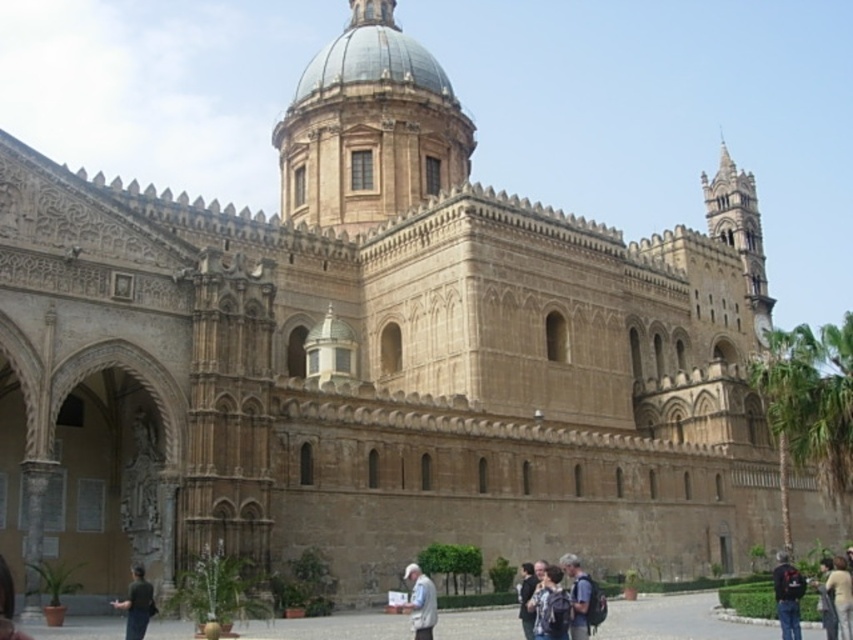
Which is more to the right, black fabric backpack at lower right or white fabric shirt at center?

From the viewer's perspective, black fabric backpack at lower right appears more on the right side.

Does black fabric backpack at lower right appear on the left side of white fabric shirt at center?

Incorrect, black fabric backpack at lower right is not on the left side of white fabric shirt at center.

Does point (782, 637) come farther from viewer compared to point (413, 589)?

No, (782, 637) is closer to viewer.

Locate an element on the screen. black fabric backpack at lower right is located at coordinates (787, 595).

Between light brown leather jacket at center and light brown leather jacket at lower right, which one appears on the left side from the viewer's perspective?

From the viewer's perspective, light brown leather jacket at lower right appears more on the left side.

Is light brown leather jacket at center smaller than light brown leather jacket at lower right?

No, light brown leather jacket at center is not smaller than light brown leather jacket at lower right.

Between point (838, 564) and point (828, 595), which one is positioned behind?

The point (838, 564) is more distant.

This screenshot has height=640, width=853. I want to click on light brown leather jacket at center, so click(840, 595).

Between dark gray backpack at center and dark gray fabric jacket at lower left, which one appears on the right side from the viewer's perspective?

dark gray backpack at center

Which is above, dark gray backpack at center or dark gray fabric jacket at lower left?

dark gray fabric jacket at lower left

Between point (589, 579) and point (10, 618), which one is positioned in front?

Point (10, 618) is in front.

Find the location of `dark gray backpack at center`. dark gray backpack at center is located at coordinates (578, 595).